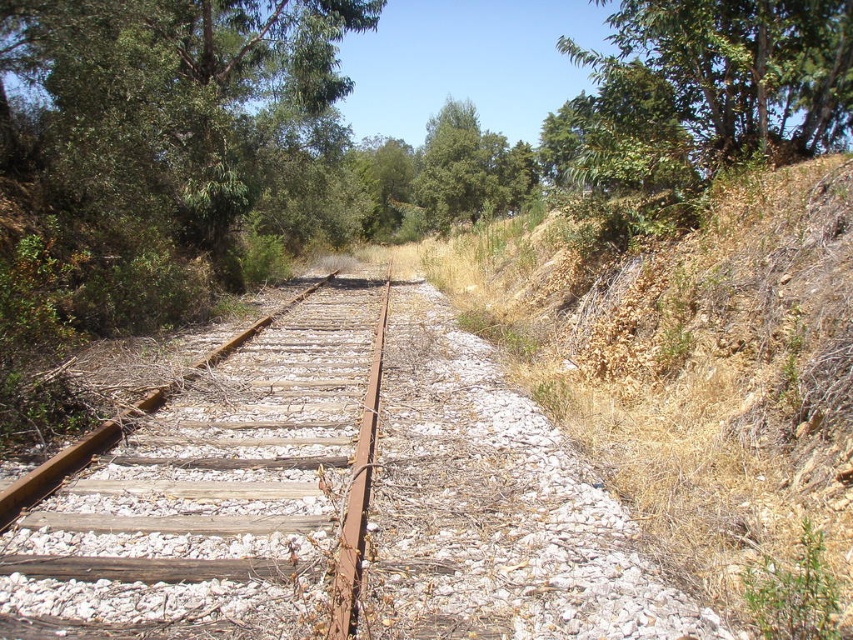
You are standing at the center of the railway track and want to walk to the dry grass at right. Which direction should you move to reach it?

To reach the dry grass at right, you should move towards the right side of the track since the dry grass at right is located at point 0.583 on the x axis and 0.819 on the y axis.

You are a hiker who wants to cross the railway track. You notice dry grass at right and green leafy tree at upper right. Which of these two objects is shorter?

The dry grass at right is shorter than the green leafy tree at upper right.

You are standing at the center of the railway track and see dry grass at right and green leafy tree at upper right. Which object is closer to your left side?

The dry grass at right is to the left of the green leafy tree at upper right, so from your perspective on the track center, the dry grass at right would be closer to your left side.